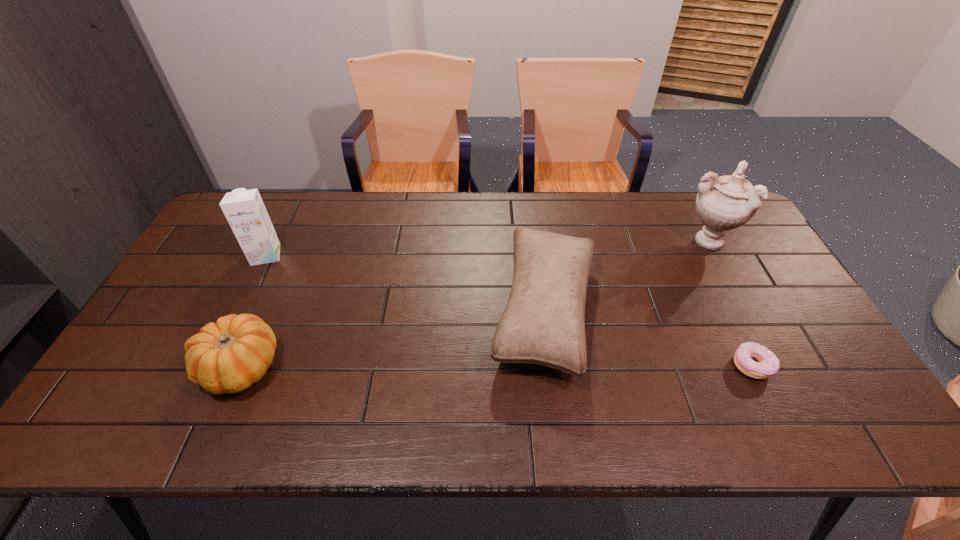
You are a GUI agent. You are given a task and a screenshot of the screen. Output one action in this format:
    pyautogui.click(x=<x>, y=<y>)
    Task: Click on the vacant space located 0.090m on the left of the shortest object
    
    Given the screenshot: What is the action you would take?
    pyautogui.click(x=697, y=366)

The height and width of the screenshot is (540, 960). What are the coordinates of `object located at the far edge` in the screenshot? It's located at (723, 203).

At what (x,y) coordinates should I click in order to perform the action: click on object that is at the near edge. Please return your answer as a coordinate pair (x, y). Image resolution: width=960 pixels, height=540 pixels. Looking at the image, I should click on (229, 356).

Where is `object that is at the left edge`? The height and width of the screenshot is (540, 960). object that is at the left edge is located at coordinates (244, 210).

In order to click on urn located in the right edge section of the desktop in this screenshot , I will do `click(723, 203)`.

The image size is (960, 540). Find the location of `doughnut present at the right edge`. doughnut present at the right edge is located at coordinates (768, 364).

The width and height of the screenshot is (960, 540). I want to click on object that is at the far right corner, so click(x=723, y=203).

The image size is (960, 540). In the image, there is a desktop. Identify the location of free space at the far edge. (288, 231).

In the image, there is a desktop. Identify the location of free region at the near edge. (451, 428).

You are a GUI agent. You are given a task and a screenshot of the screen. Output one action in this format:
    pyautogui.click(x=<x>, y=<y>)
    Task: Click on the vacant space at the right edge of the desktop
    The width and height of the screenshot is (960, 540).
    Given the screenshot: What is the action you would take?
    pyautogui.click(x=853, y=400)